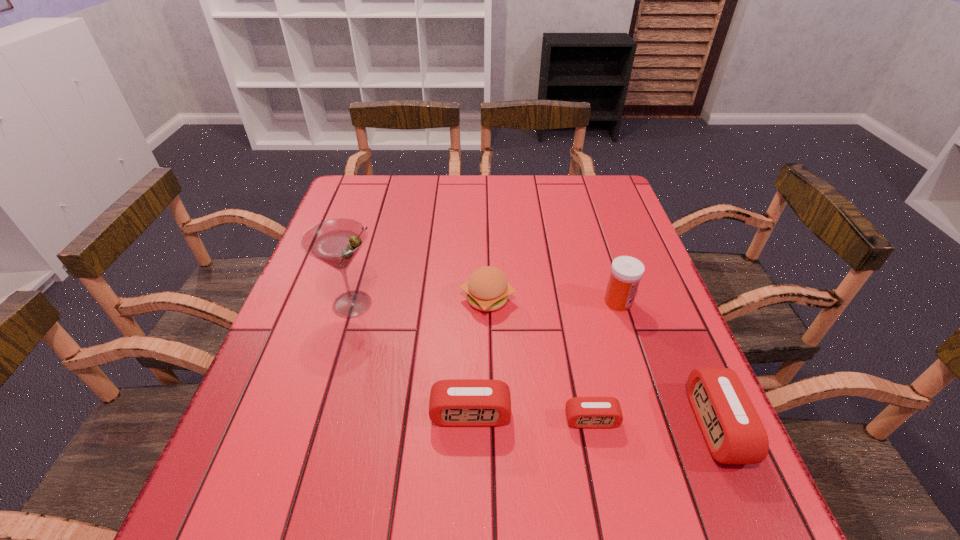
The alarm clocks are evenly distributed in the image. To maintain this, where would you place another alarm clock on the left? Please point to a free space. Please provide its 2D coordinates. Your answer should be formatted as a tuple, i.e. [(x, y)], where the tuple contains the x and y coordinates of a point satisfying the conditions above.

[(351, 408)]